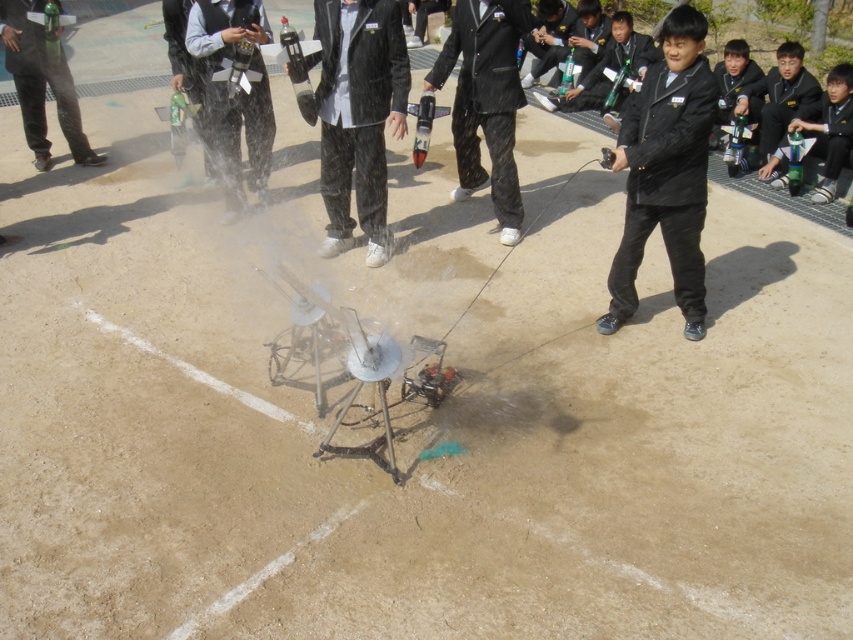
Question: Which of these objects is positioned closest to the black velvet suit at center?

Choices:
 (A) brushed metal water gun at center
 (B) black matte suit at center
 (C) matte black pants at left

Answer: (A)

Question: Does black matte suit at center appear over black textured suit at center?

Choices:
 (A) no
 (B) yes

Answer: (A)

Question: Does matte black pants at left appear on the right side of black matte jacket at upper right?

Choices:
 (A) yes
 (B) no

Answer: (B)

Question: Which point is farther to the camera?

Choices:
 (A) (241, 106)
 (B) (334, 76)

Answer: (A)

Question: Which object appears closest to the camera in this image?

Choices:
 (A) black matte jacket at upper right
 (B) matte black pants at left

Answer: (B)

Question: Does black velvet suit at center appear over matte black pants at left?

Choices:
 (A) yes
 (B) no

Answer: (B)